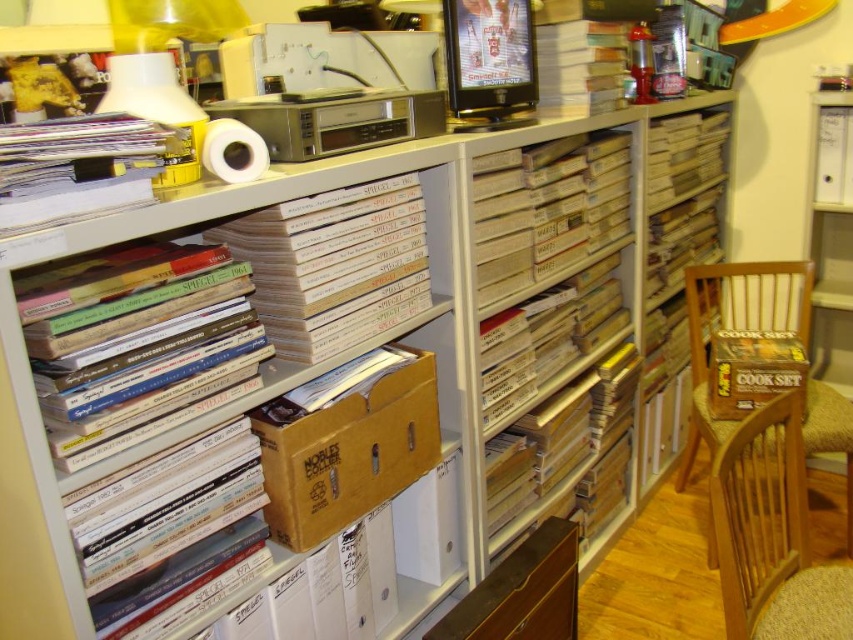
Is point (149, 307) closer to viewer compared to point (370, 284)?

Yes, it is in front of point (370, 284).

Is hardcover books at left thinner than yellow paperbacks at center?

Yes.

This screenshot has height=640, width=853. What do you see at coordinates (144, 348) in the screenshot?
I see `hardcover books at left` at bounding box center [144, 348].

Find the location of a particular element. hardcover books at left is located at coordinates (144, 348).

Who is higher up, hardcover books at left or brown cardboard box at right?

Positioned higher is hardcover books at left.

The height and width of the screenshot is (640, 853). What do you see at coordinates (144, 348) in the screenshot? I see `hardcover books at left` at bounding box center [144, 348].

You are a GUI agent. You are given a task and a screenshot of the screen. Output one action in this format:
    pyautogui.click(x=<x>, y=<y>)
    Task: Click on the hardcover books at left
    This screenshot has width=853, height=640.
    Given the screenshot: What is the action you would take?
    pyautogui.click(x=144, y=348)

Can you confirm if yellow paperbacks at center is shorter than beige cardboard box at center?

Indeed, yellow paperbacks at center has a lesser height compared to beige cardboard box at center.

Which is in front, point (404, 188) or point (492, 208)?

Point (404, 188)

Identify the location of yellow paperbacks at center. The height and width of the screenshot is (640, 853). (335, 264).